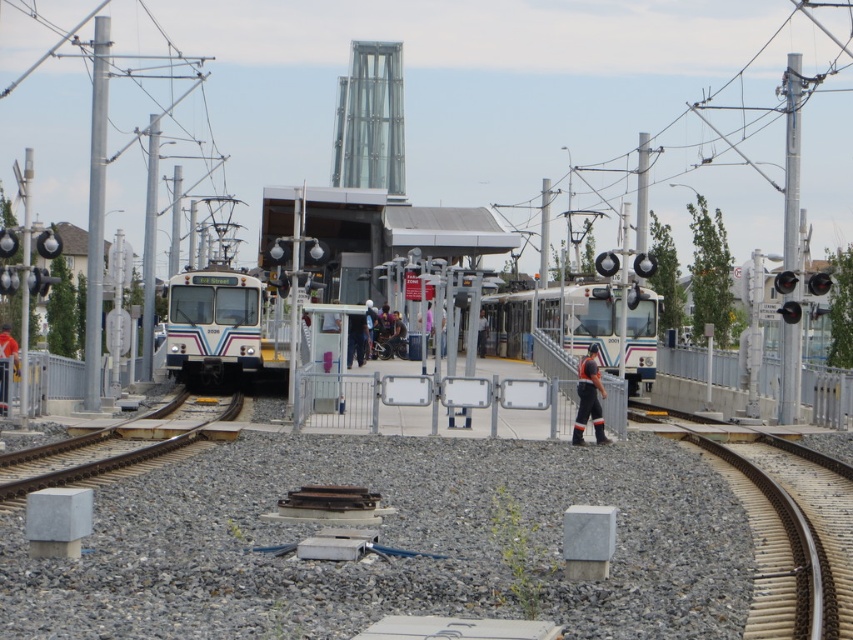
You are a passenger standing at the center of the station and see the brown wooden train track at lower right and the matte black person at center. Which object is closer to the ground?

The brown wooden train track at lower right is located below the matte black person at center, so it is closer to the ground.

You are a maintenance worker at the station. You need to inspect the orange reflective pants at center and the matte black person at center. The safety protocol states that you must stay at least 30 feet away from both objects. Can you safely inspect both objects without violating the safety distance?

The orange reflective pants at center is 33.18 feet from matte black person at center. Since the minimum required distance is 30 feet, the distance between them is sufficient. Therefore, you can safely inspect both objects without violating the safety distance.

You are a photographer standing at the entrance of the train station. You want to take a photo of both point [595,396] and point [4,374]. Which point will appear larger in your photo?

Point [595,396] is closer to the camera than point [4,374], so it will appear larger in the photo.